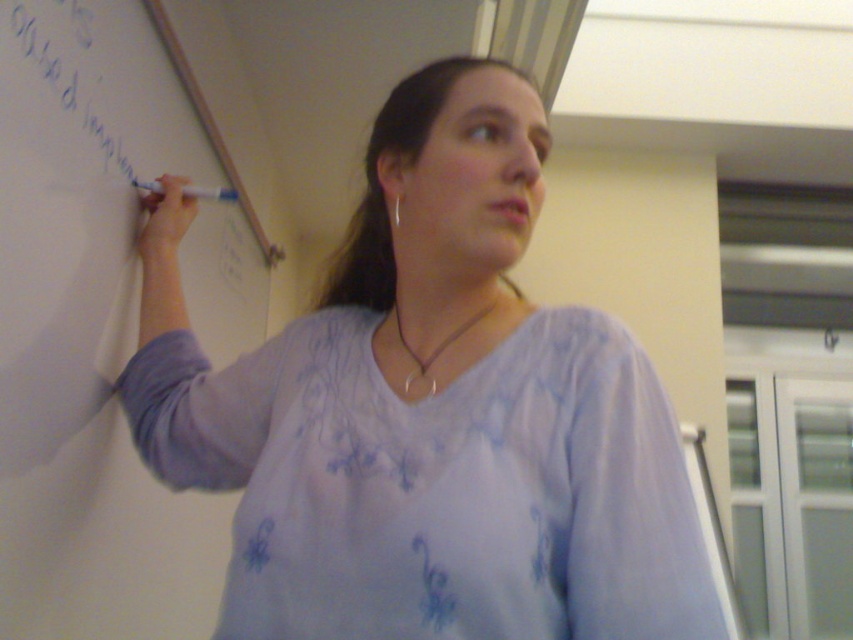
Question: Is light purple fabric at upper left to the right of white marker at upper left from the viewer's perspective?

Choices:
 (A) no
 (B) yes

Answer: (B)

Question: Observing the image, what is the correct spatial positioning of whiteboard at left in reference to white marker at upper left?

Choices:
 (A) below
 (B) above

Answer: (A)

Question: Which object is the farthest from the whiteboard at left?

Choices:
 (A) light purple fabric at upper left
 (B) white marker at upper left

Answer: (A)

Question: Which is nearer to the whiteboard at left?

Choices:
 (A) light purple fabric at upper left
 (B) white marker at upper left

Answer: (B)

Question: Which of the following is the closest to the observer?

Choices:
 (A) light purple fabric at upper left
 (B) whiteboard at left

Answer: (A)

Question: Where is whiteboard at left located in relation to white marker at upper left in the image?

Choices:
 (A) right
 (B) left

Answer: (B)